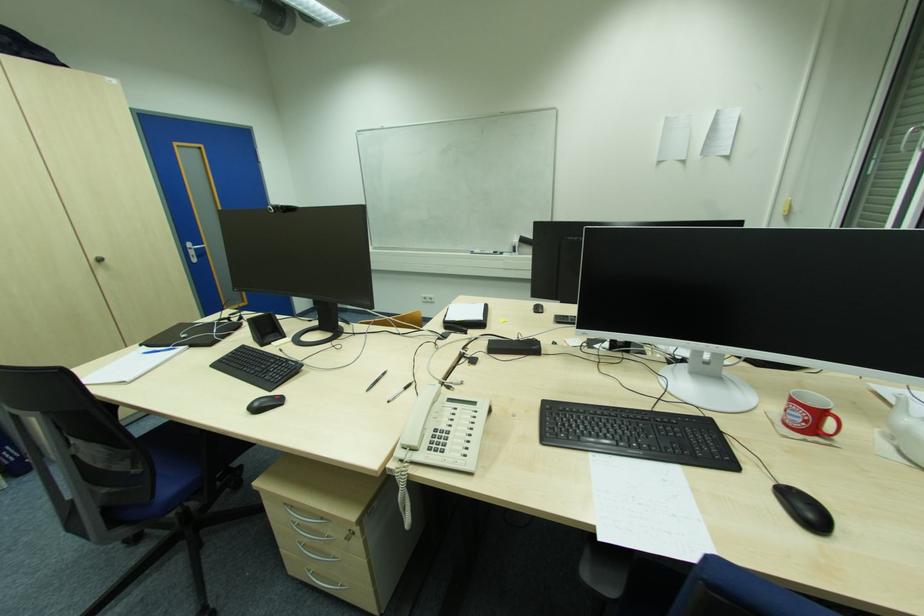
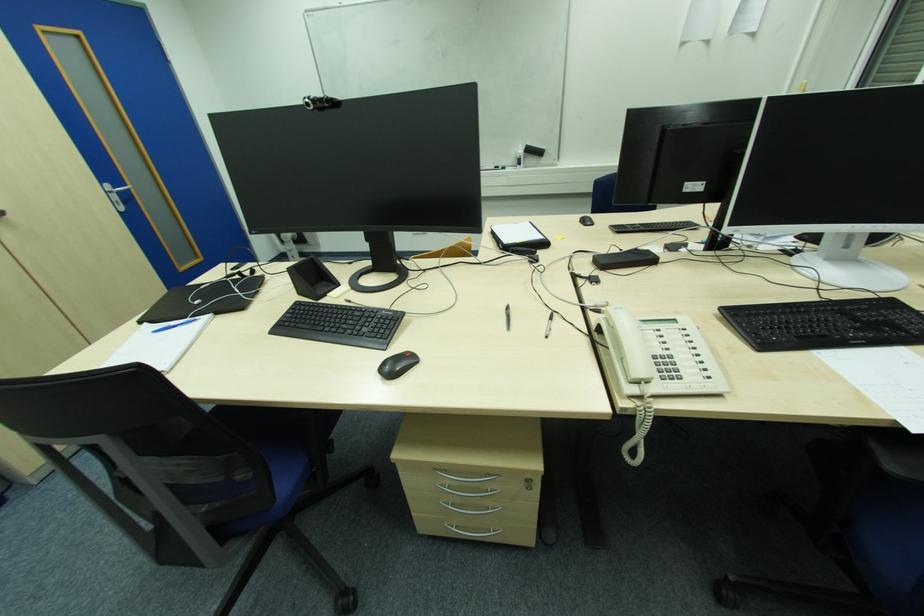
Where in the second image is the point corresponding to point 174,349 from the first image?

(190, 320)